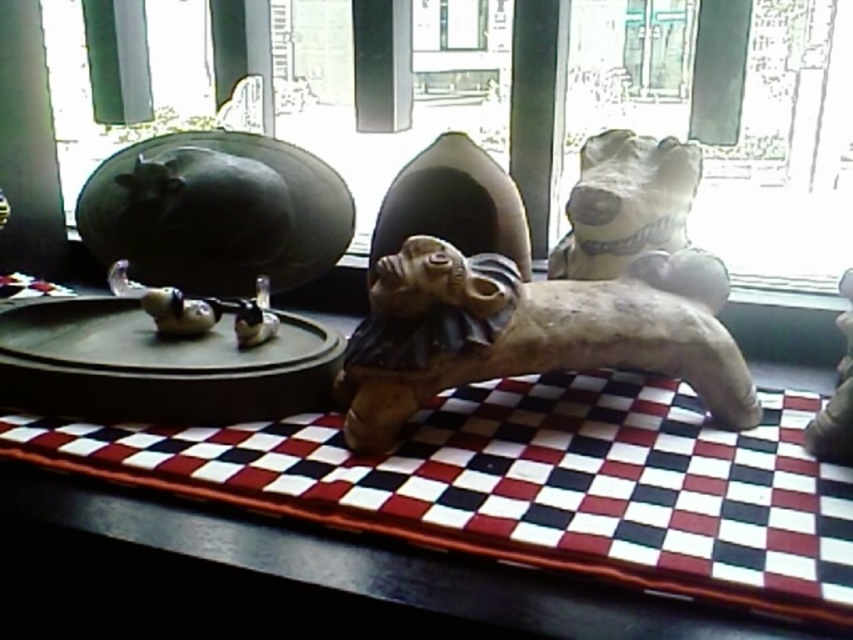
Question: Can you confirm if matte black statue at center is wider than brown clay dog at center?

Choices:
 (A) yes
 (B) no

Answer: (A)

Question: Is matte black statue at center thinner than brown clay dog at center?

Choices:
 (A) no
 (B) yes

Answer: (A)

Question: Estimate the real-world distances between objects in this image. Which object is closer to the brown clay dog at center?

Choices:
 (A) checkerboard-patterned table at center
 (B) matte black statue at center

Answer: (A)

Question: Which point is farther to the camera?

Choices:
 (A) checkerboard-patterned table at center
 (B) brown clay dog at center
 (C) matte black statue at center

Answer: (C)

Question: Which point appears closest to the camera in this image?

Choices:
 (A) (396, 355)
 (B) (341, 554)

Answer: (B)

Question: Is matte black statue at center positioned in front of checkerboard-patterned table at center?

Choices:
 (A) no
 (B) yes

Answer: (A)